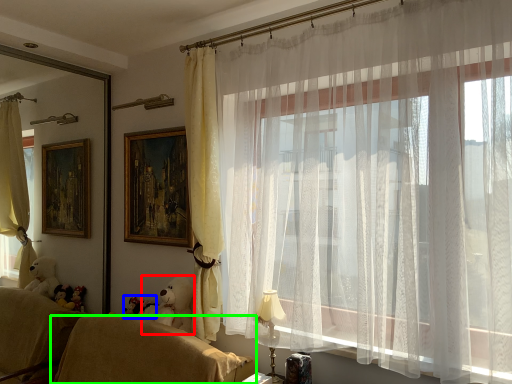
Question: Considering the real-world distances, which object is farthest from animal (highlighted by a red box)? toy (highlighted by a blue box) or furniture (highlighted by a green box)?

Choices:
 (A) toy
 (B) furniture

Answer: (B)